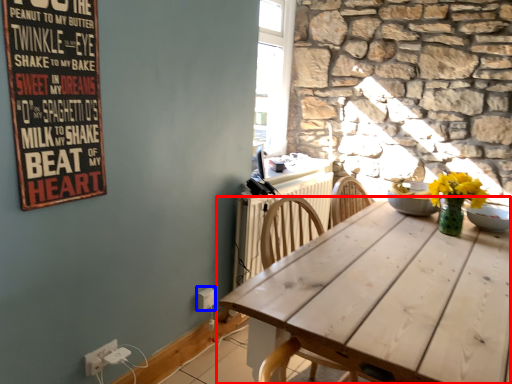
Question: Which object appears farthest to the camera in this image, table (highlighted by a red box) or electric outlet (highlighted by a blue box)?

Choices:
 (A) table
 (B) electric outlet

Answer: (B)